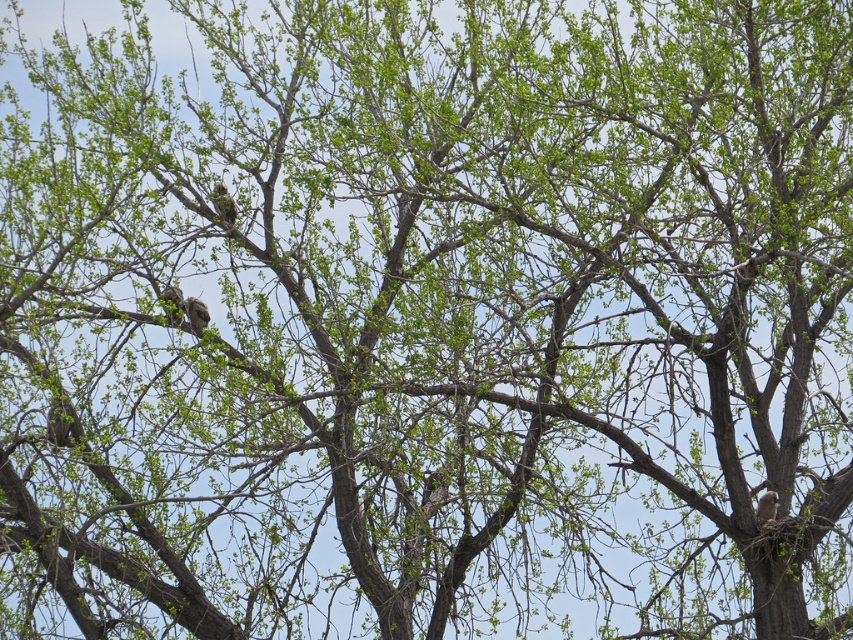
Question: Can you confirm if green textured bird at center is wider than brown feathered owl at lower right?

Choices:
 (A) yes
 (B) no

Answer: (A)

Question: In this image, where is green textured bird at center located relative to brown speckled feathers at center?

Choices:
 (A) above
 (B) below

Answer: (A)

Question: Which point is closer to the camera taking this photo?

Choices:
 (A) (236, 214)
 (B) (761, 499)

Answer: (B)

Question: Which point appears farthest from the camera in this image?

Choices:
 (A) (183, 307)
 (B) (164, 298)
 (C) (773, 502)

Answer: (A)

Question: Which object appears farthest from the camera in this image?

Choices:
 (A) brown feathered owl at center
 (B) green textured bird at center

Answer: (B)

Question: Is brown feathered owl at center to the right of brown feathered owl at lower right from the viewer's perspective?

Choices:
 (A) no
 (B) yes

Answer: (A)